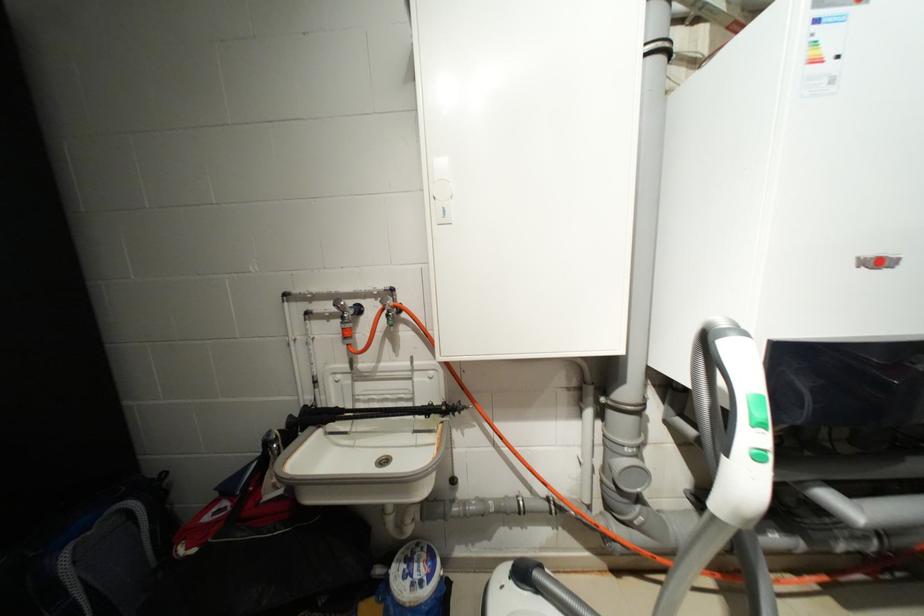
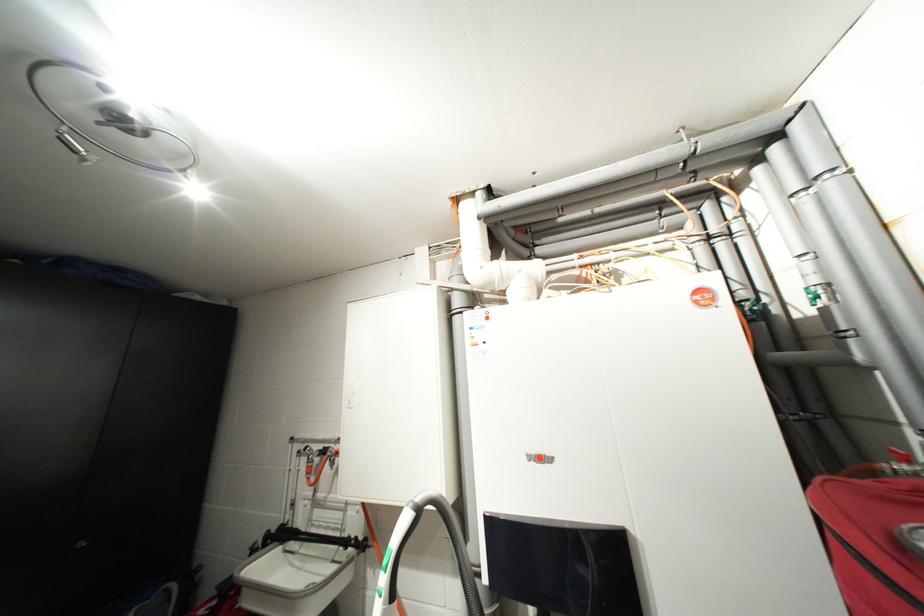
What movement of the cameraman would produce the second image?

The cameraman walked toward right, backward.